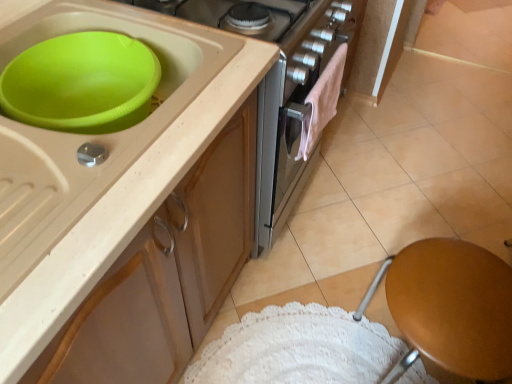
Question: Does pink fluffy towel at center have a lesser height compared to beige matte tile at upper right?

Choices:
 (A) no
 (B) yes

Answer: (A)

Question: Does pink fluffy towel at center have a lesser width compared to beige matte tile at upper right?

Choices:
 (A) yes
 (B) no

Answer: (A)

Question: Could you tell me if pink fluffy towel at center is turned towards beige matte tile at upper right?

Choices:
 (A) yes
 (B) no

Answer: (B)

Question: From a real-world perspective, is pink fluffy towel at center located beneath beige matte tile at upper right?

Choices:
 (A) no
 (B) yes

Answer: (A)

Question: Considering the relative positions of pink fluffy towel at center and beige matte tile at upper right in the image provided, is pink fluffy towel at center in front of beige matte tile at upper right?

Choices:
 (A) yes
 (B) no

Answer: (A)

Question: Is matte beige cabinet at upper left taller or shorter than pink fluffy towel at center?

Choices:
 (A) tall
 (B) short

Answer: (B)

Question: From the image's perspective, is matte beige cabinet at upper left located above or below pink fluffy towel at center?

Choices:
 (A) above
 (B) below

Answer: (B)

Question: Is point (179, 34) positioned closer to the camera than point (305, 119)?

Choices:
 (A) farther
 (B) closer

Answer: (B)

Question: Which is correct: matte beige cabinet at upper left is inside pink fluffy towel at center, or outside of it?

Choices:
 (A) outside
 (B) inside

Answer: (A)

Question: Does point click(126, 370) appear closer or farther from the camera than point click(472, 319)?

Choices:
 (A) farther
 (B) closer

Answer: (B)

Question: Based on their sizes in the image, would you say matte beige cabinet at upper left is bigger or smaller than brown wooden stool at lower right?

Choices:
 (A) big
 (B) small

Answer: (B)

Question: From a real-world perspective, is matte beige cabinet at upper left above or below brown wooden stool at lower right?

Choices:
 (A) above
 (B) below

Answer: (A)

Question: In the image, is matte beige cabinet at upper left positioned in front of or behind brown wooden stool at lower right?

Choices:
 (A) behind
 (B) front

Answer: (B)

Question: In terms of size, does beige matte tile at upper right appear bigger or smaller than pink fluffy towel at center?

Choices:
 (A) small
 (B) big

Answer: (B)

Question: Relative to pink fluffy towel at center, is beige matte tile at upper right in front or behind?

Choices:
 (A) front
 (B) behind

Answer: (B)